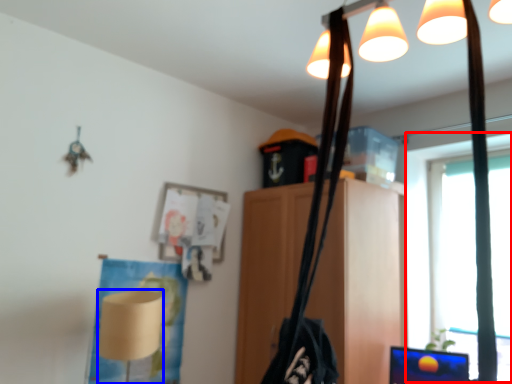
Question: Among these objects, which one is farthest to the camera, window screen (highlighted by a red box) or lamp (highlighted by a blue box)?

Choices:
 (A) window screen
 (B) lamp

Answer: (A)